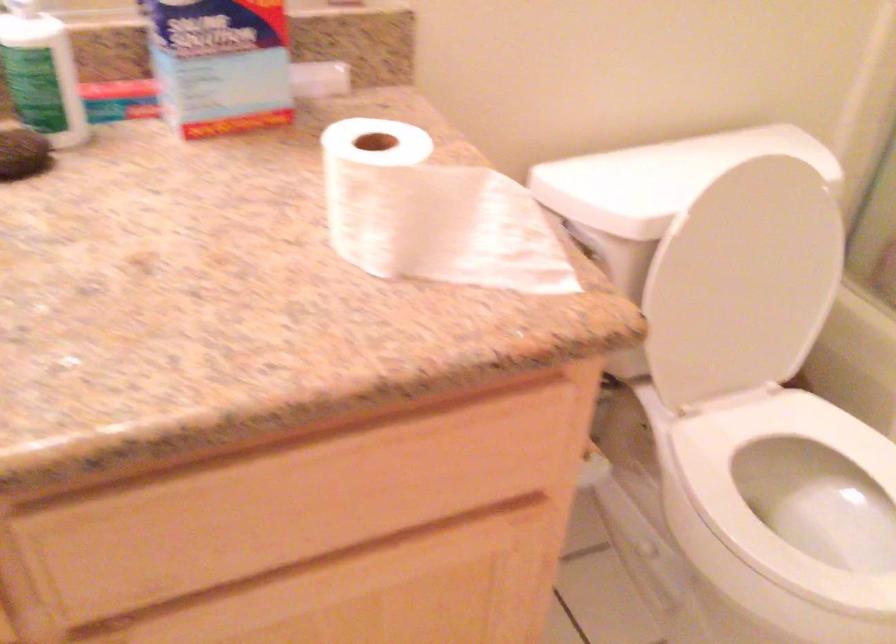
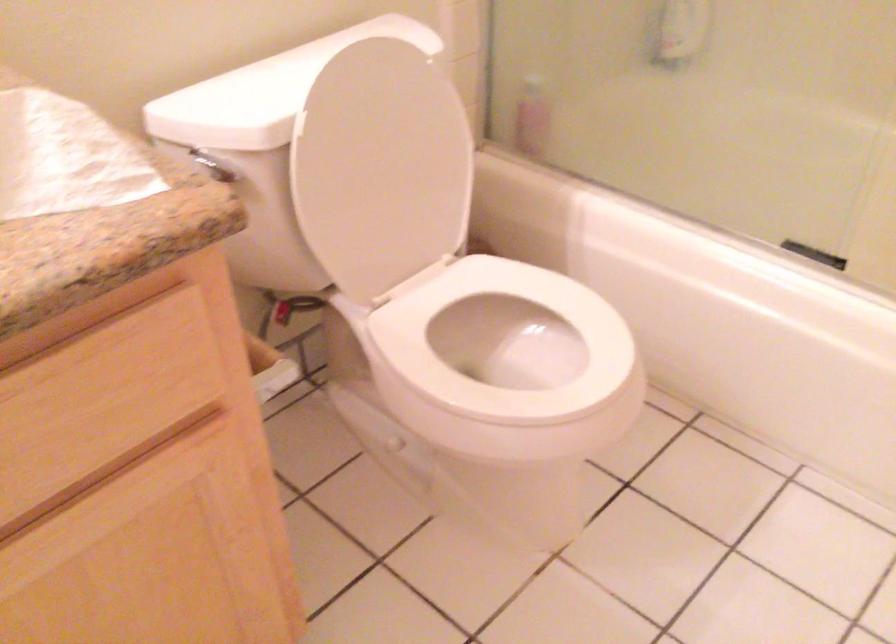
Locate, in the second image, the point that corresponds to point 733,281 in the first image.

(381, 167)